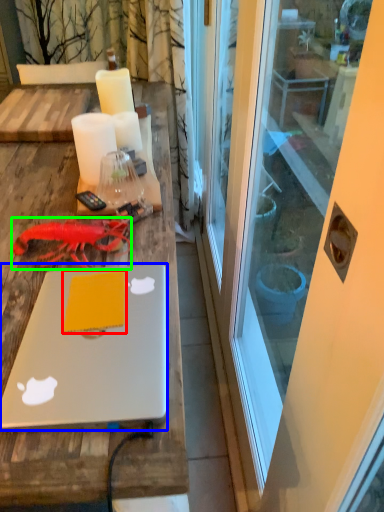
Question: Which object is the closest to the notepad (highlighted by a red box)? Choose among these: laptop (highlighted by a blue box) or lobster (highlighted by a green box).

Choices:
 (A) laptop
 (B) lobster

Answer: (A)